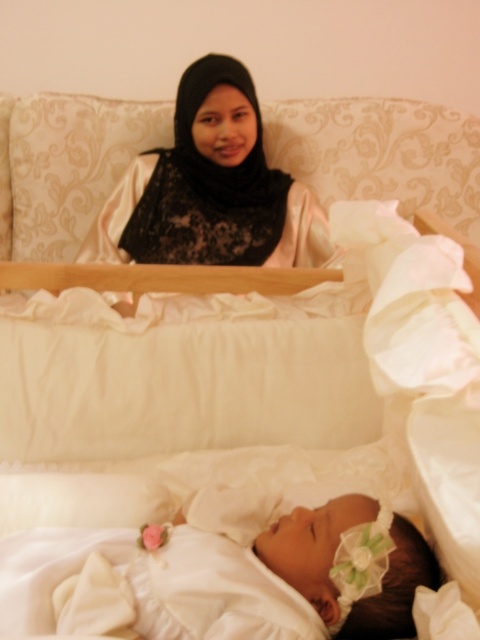
Looking at this image, does white satin dress at lower center appear on the right side of matte black hijab at upper center?

Correct, you'll find white satin dress at lower center to the right of matte black hijab at upper center.

Which is more to the right, white satin dress at lower center or matte black hijab at upper center?

white satin dress at lower center is more to the right.

Who is more forward, (415, 563) or (162, 256)?

Point (415, 563) is more forward.

Image resolution: width=480 pixels, height=640 pixels. What are the coordinates of `white satin dress at lower center` in the screenshot? It's located at (216, 579).